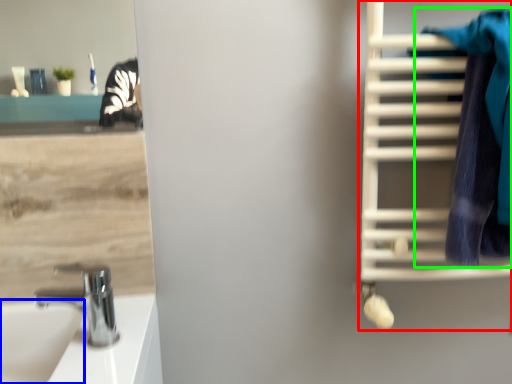
Question: Considering the real-world distances, which object is closest to bunk bed (highlighted by a red box)? sink (highlighted by a blue box) or bath towel (highlighted by a green box).

Choices:
 (A) sink
 (B) bath towel

Answer: (B)